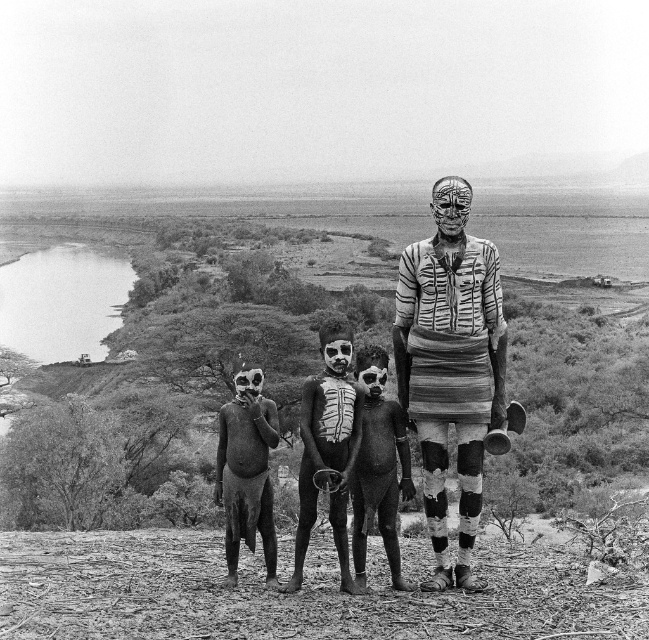
Does black textured body paint at center appear under smooth skin child at center?

No, black textured body paint at center is not below smooth skin child at center.

Does black textured body paint at center lie in front of smooth skin child at center?

No, it is not.

Identify the location of black textured body paint at center. The height and width of the screenshot is (640, 649). (326, 445).

Identify the location of black textured body paint at center. The height and width of the screenshot is (640, 649). [x=326, y=445].

Which is more to the left, painted wood figure at center or smooth skin child at center?

From the viewer's perspective, smooth skin child at center appears more on the left side.

In the scene shown: Which of these two, painted wood figure at center or smooth skin child at center, stands shorter?

smooth skin child at center is shorter.

Where is `painted wood figure at center`? Image resolution: width=649 pixels, height=640 pixels. painted wood figure at center is located at coordinates (450, 365).

Can you confirm if painted wood figure at center is bigger than black textured body paint at center?

Actually, painted wood figure at center might be smaller than black textured body paint at center.

Identify the location of painted wood figure at center. The width and height of the screenshot is (649, 640). (450, 365).

Describe the element at coordinates (450, 365) in the screenshot. I see `painted wood figure at center` at that location.

At what (x,y) coordinates should I click in order to perform the action: click on painted wood figure at center. Please return your answer as a coordinate pair (x, y). The image size is (649, 640). Looking at the image, I should click on (450, 365).